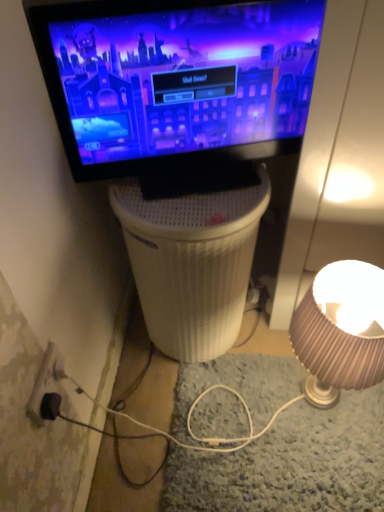
Question: Does point (339, 360) appear closer or farther from the camera than point (228, 159)?

Choices:
 (A) farther
 (B) closer

Answer: (B)

Question: Based on their sizes in the image, would you say matte beige lampshade at right is bigger or smaller than matte black monitor at upper center?

Choices:
 (A) small
 (B) big

Answer: (B)

Question: Estimate the real-world distances between objects in this image. Which object is closer to the matte beige lampshade at right?

Choices:
 (A) black plastic power outlet at lower left
 (B) matte black monitor at upper center
 (C) white ribbed plastic at center

Answer: (C)

Question: Based on their relative distances, which object is farther from the black plastic power outlet at lower left?

Choices:
 (A) matte black monitor at upper center
 (B) white ribbed plastic at center
 (C) matte beige lampshade at right

Answer: (C)